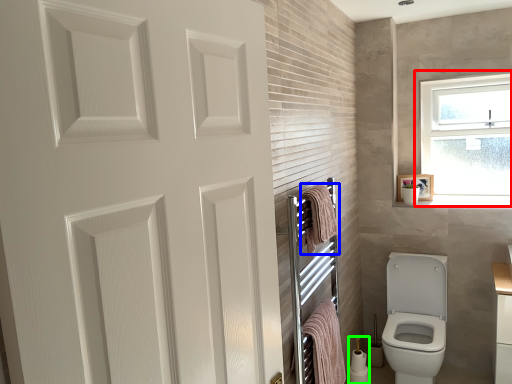
Question: Considering the real-world distances, which object is closest to window (highlighted by a red box)? bath towel (highlighted by a blue box) or toilet paper (highlighted by a green box).

Choices:
 (A) bath towel
 (B) toilet paper

Answer: (B)